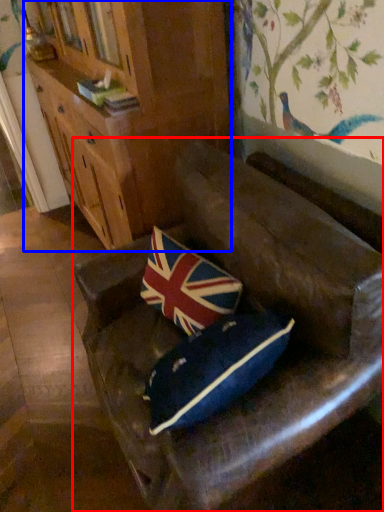
Question: Among these objects, which one is farthest to the camera, furniture (highlighted by a red box) or cabinetry (highlighted by a blue box)?

Choices:
 (A) furniture
 (B) cabinetry

Answer: (B)